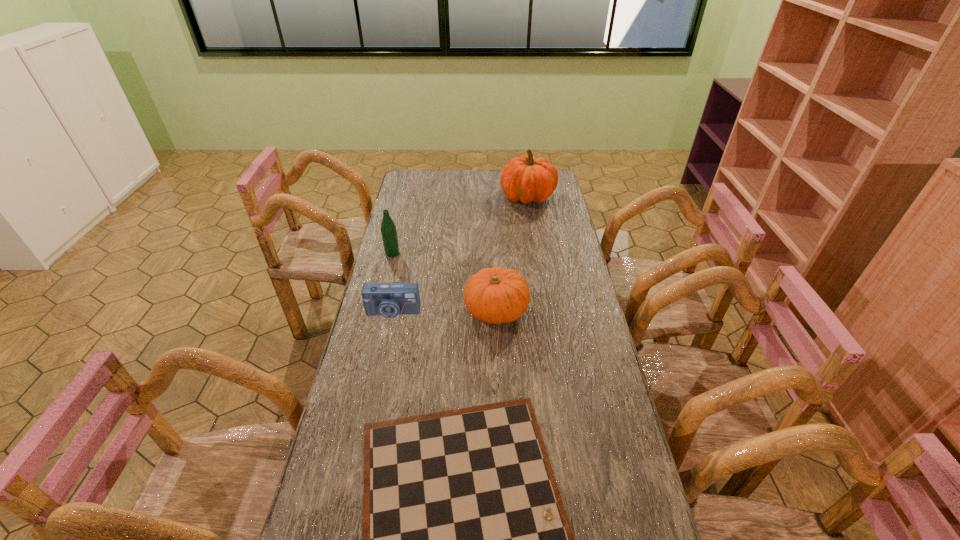
You are a GUI agent. You are given a task and a screenshot of the screen. Output one action in this format:
    pyautogui.click(x=<x>, y=<y>)
    Task: Click on the free spot located 0.400m on the lens of the camera
    
    Given the screenshot: What is the action you would take?
    pyautogui.click(x=368, y=428)

At what (x,y) coordinates should I click in order to perform the action: click on object that is at the far edge. Please return your answer as a coordinate pair (x, y). Looking at the image, I should click on (525, 178).

This screenshot has width=960, height=540. Find the location of `bottle at the left edge`. bottle at the left edge is located at coordinates (388, 228).

Where is `camera present at the left edge`? The height and width of the screenshot is (540, 960). camera present at the left edge is located at coordinates (389, 300).

You are a GUI agent. You are given a task and a screenshot of the screen. Output one action in this format:
    pyautogui.click(x=<x>, y=<y>)
    Task: Click on the object that is at the right edge
    
    Given the screenshot: What is the action you would take?
    525,178

At what (x,y) coordinates should I click in order to perform the action: click on object that is positioned at the far right corner. Please return your answer as a coordinate pair (x, y). The image size is (960, 540). Looking at the image, I should click on (525, 178).

Locate an element on the screen. This screenshot has height=540, width=960. vacant space at the far edge of the desktop is located at coordinates (472, 171).

In the image, there is a desktop. Identify the location of vacant area at the left edge. (359, 485).

Locate an element on the screen. Image resolution: width=960 pixels, height=540 pixels. vacant area at the right edge is located at coordinates (552, 215).

Where is `blank space at the far left corner`? blank space at the far left corner is located at coordinates (426, 184).